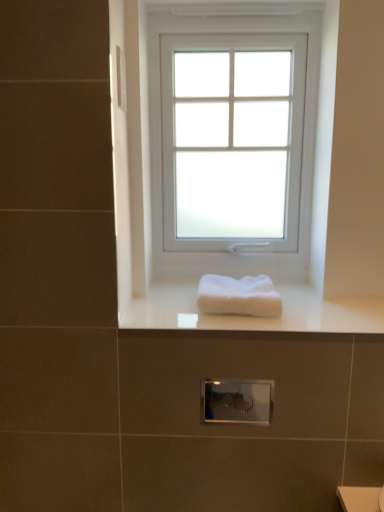
Where is `free spot above white frosted glass window at center (from a real-world perspective)`? Image resolution: width=384 pixels, height=512 pixels. free spot above white frosted glass window at center (from a real-world perspective) is located at coordinates (232, 7).